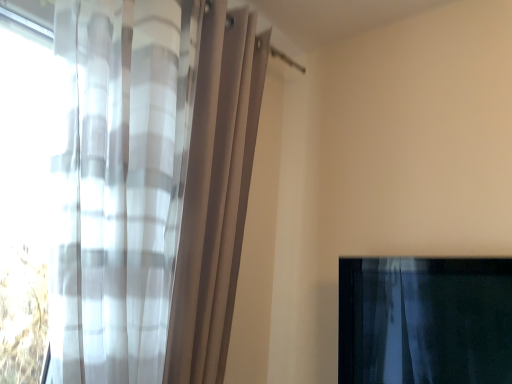
Question: Is point (481, 284) positioned closer to the camera than point (69, 64)?

Choices:
 (A) farther
 (B) closer

Answer: (A)

Question: Is translucent fabric curtain at lower right, arranged as the second curtain when viewed from the left, taller or shorter than sheer white curtain at left, acting as the 2th curtain starting from the right?

Choices:
 (A) short
 (B) tall

Answer: (A)

Question: Considering the relative positions of translucent fabric curtain at lower right, arranged as the second curtain when viewed from the left, and sheer white curtain at left, arranged as the first curtain when viewed from the left, in the image provided, is translucent fabric curtain at lower right, arranged as the second curtain when viewed from the left, to the left or to the right of sheer white curtain at left, arranged as the first curtain when viewed from the left,?

Choices:
 (A) left
 (B) right

Answer: (B)

Question: Considering the positions of sheer white curtain at left, acting as the 2th curtain starting from the right, and translucent fabric curtain at lower right, positioned as the first curtain in right-to-left order, in the image, is sheer white curtain at left, acting as the 2th curtain starting from the right, wider or thinner than translucent fabric curtain at lower right, positioned as the first curtain in right-to-left order,?

Choices:
 (A) wide
 (B) thin

Answer: (A)

Question: Would you say sheer white curtain at left, arranged as the first curtain when viewed from the left, is to the left or to the right of translucent fabric curtain at lower right, arranged as the second curtain when viewed from the left, in the picture?

Choices:
 (A) left
 (B) right

Answer: (A)

Question: Is sheer white curtain at left, arranged as the first curtain when viewed from the left, in front of or behind translucent fabric curtain at lower right, arranged as the second curtain when viewed from the left, in the image?

Choices:
 (A) front
 (B) behind

Answer: (A)

Question: From the image's perspective, relative to translucent fabric curtain at lower right, positioned as the first curtain in right-to-left order, is sheer white curtain at left, arranged as the first curtain when viewed from the left, above or below?

Choices:
 (A) below
 (B) above

Answer: (B)